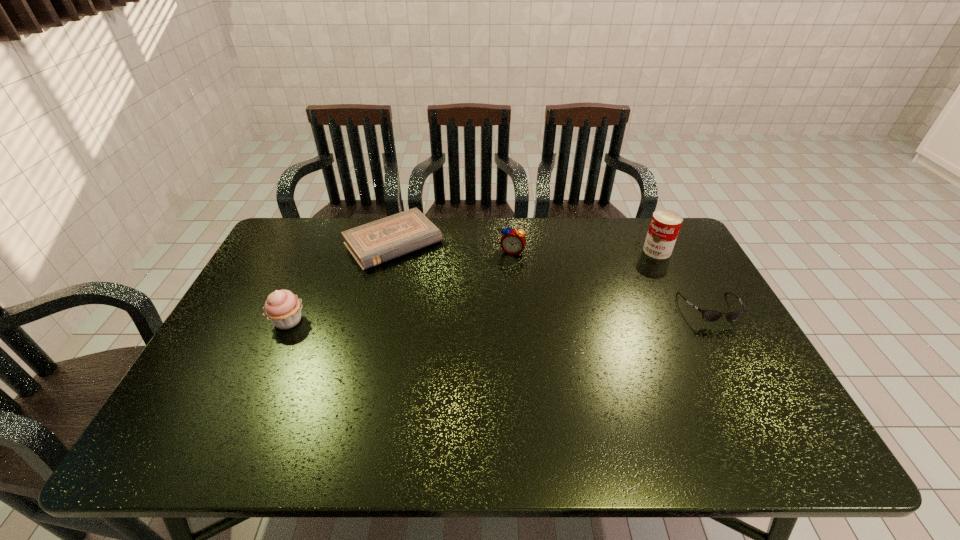
In order to click on blank area located on the front label of the tallest object in this screenshot , I will do `click(567, 310)`.

Find the location of a particular element. free space located 0.380m on the front-facing side of the third object from right to left is located at coordinates (483, 345).

Identify the location of free spot located on the front-facing side of the third object from right to left. The height and width of the screenshot is (540, 960). (494, 305).

Locate an element on the screen. This screenshot has width=960, height=540. free spot located on the front-facing side of the third object from right to left is located at coordinates (485, 339).

At what (x,y) coordinates should I click in order to perform the action: click on blank space located 0.200m on the spine side of the fourth object from right to left. Please return your answer as a coordinate pair (x, y). Looking at the image, I should click on (448, 305).

Identify the location of free point located 0.340m on the spine side of the fourth object from right to left. Image resolution: width=960 pixels, height=540 pixels. (475, 335).

This screenshot has width=960, height=540. Find the location of `free space located 0.220m on the spine side of the fourth object from right to left`. free space located 0.220m on the spine side of the fourth object from right to left is located at coordinates (452, 309).

Identify the location of can that is at the far edge. (665, 224).

Identify the location of alarm clock that is at the far edge. This screenshot has height=540, width=960. (x=513, y=241).

Where is `Bible positioned at the far edge`? This screenshot has height=540, width=960. Bible positioned at the far edge is located at coordinates (371, 244).